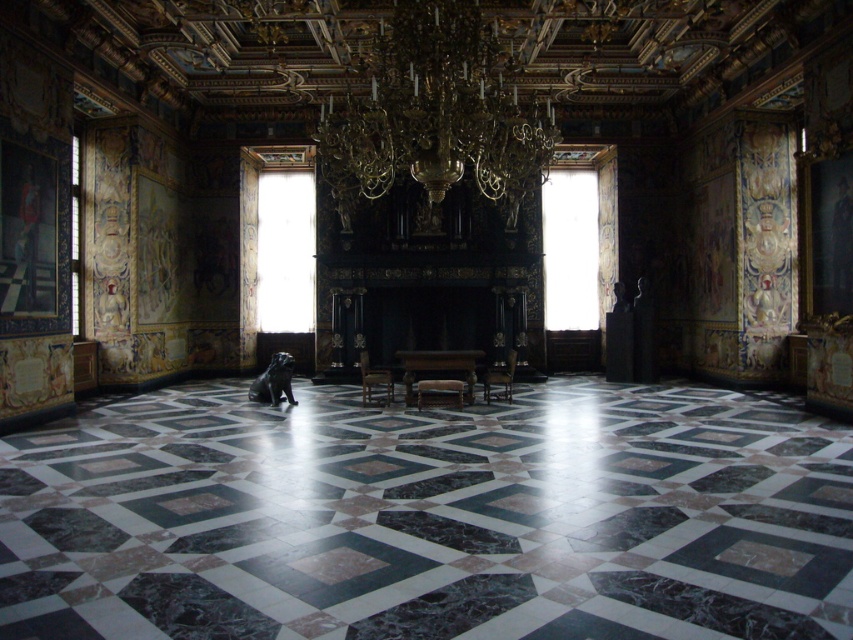
Question: Which object is closer to the camera taking this photo?

Choices:
 (A) wooden polished chair at center
 (B) wooden chair at center
 (C) gold/gilded metal chandelier at upper center

Answer: (C)

Question: Where is gold/gilded metal chandelier at upper center located in relation to wooden polished chair at center in the image?

Choices:
 (A) above
 (B) below

Answer: (A)

Question: Which object is the farthest from the wooden polished chair at center?

Choices:
 (A) gold/gilded metal chandelier at upper center
 (B) wooden chair at center

Answer: (A)

Question: Where is gold/gilded metal chandelier at upper center located in relation to wooden chair at center in the image?

Choices:
 (A) below
 (B) above

Answer: (B)

Question: Among these objects, which one is nearest to the camera?

Choices:
 (A) gold/gilded metal chandelier at upper center
 (B) wooden polished chair at center
 (C) wooden chair at center

Answer: (A)

Question: Does gold/gilded metal chandelier at upper center have a smaller size compared to wooden polished chair at center?

Choices:
 (A) yes
 (B) no

Answer: (A)